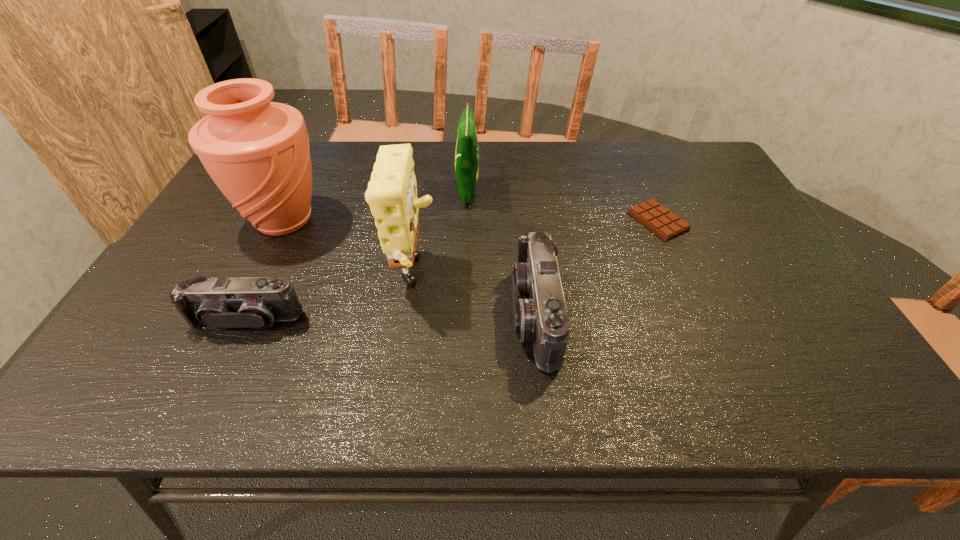
You are a GUI agent. You are given a task and a screenshot of the screen. Output one action in this format:
    pyautogui.click(x=<x>, y=<y>)
    Task: Click on the vase located at the left edge
    The height and width of the screenshot is (540, 960).
    Given the screenshot: What is the action you would take?
    pyautogui.click(x=257, y=152)

Where is `object that is at the near left corner`? object that is at the near left corner is located at coordinates coord(219,303).

The width and height of the screenshot is (960, 540). In the image, there is a desktop. What are the coordinates of `vacant space at the far edge` in the screenshot? It's located at (648, 168).

This screenshot has height=540, width=960. Find the location of `vacant space at the near edge of the desktop`. vacant space at the near edge of the desktop is located at coordinates (295, 343).

You are a GUI agent. You are given a task and a screenshot of the screen. Output one action in this format:
    pyautogui.click(x=<x>, y=<y>)
    Task: Click on the free space at the right edge of the desktop
    This screenshot has height=540, width=960.
    Given the screenshot: What is the action you would take?
    pyautogui.click(x=754, y=216)

In the image, there is a desktop. Where is `free region at the far right corner`? free region at the far right corner is located at coordinates (711, 165).

Where is `free region at the near right corner of the desktop`? This screenshot has width=960, height=540. free region at the near right corner of the desktop is located at coordinates (765, 339).

This screenshot has width=960, height=540. I want to click on free space between the fifth tallest object and the candy bar, so click(452, 271).

Where is `vacant space in between the vase and the shortest object`? Image resolution: width=960 pixels, height=540 pixels. vacant space in between the vase and the shortest object is located at coordinates (471, 221).

The image size is (960, 540). Find the location of `empty space that is in between the fifth shortest object and the shorter camcorder`. empty space that is in between the fifth shortest object and the shorter camcorder is located at coordinates (330, 299).